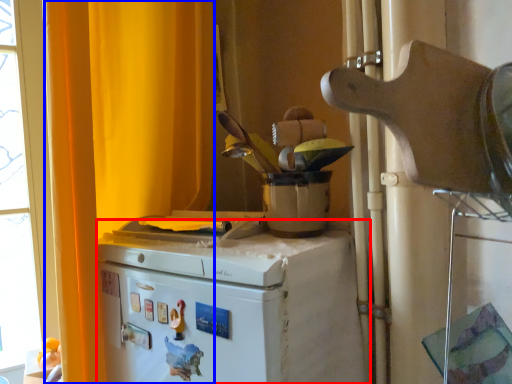
Question: Which of the following is the farthest to the observer, home appliance (highlighted by a red box) or curtain (highlighted by a blue box)?

Choices:
 (A) home appliance
 (B) curtain

Answer: (B)